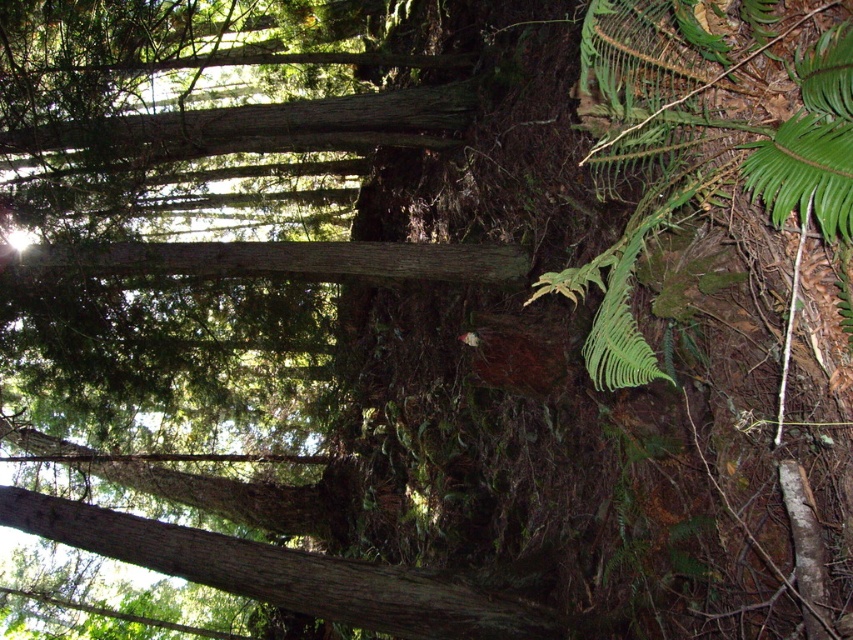
Question: Which point appears farthest from the camera in this image?

Choices:
 (A) (646, 138)
 (B) (344, 268)

Answer: (B)

Question: From the image, what is the correct spatial relationship of green leafy fern at lower right in relation to smooth brown log at center?

Choices:
 (A) left
 (B) right

Answer: (B)

Question: Which of the following is the closest to the observer?

Choices:
 (A) (302, 250)
 (B) (686, 67)

Answer: (B)

Question: Among these points, which one is nearest to the camera?

Choices:
 (A) (229, 264)
 (B) (636, 205)

Answer: (B)

Question: Is green leafy fern at lower right wider than smooth brown log at center?

Choices:
 (A) no
 (B) yes

Answer: (A)

Question: Considering the relative positions of green leafy fern at lower right and smooth brown log at center in the image provided, where is green leafy fern at lower right located with respect to smooth brown log at center?

Choices:
 (A) below
 (B) above

Answer: (A)